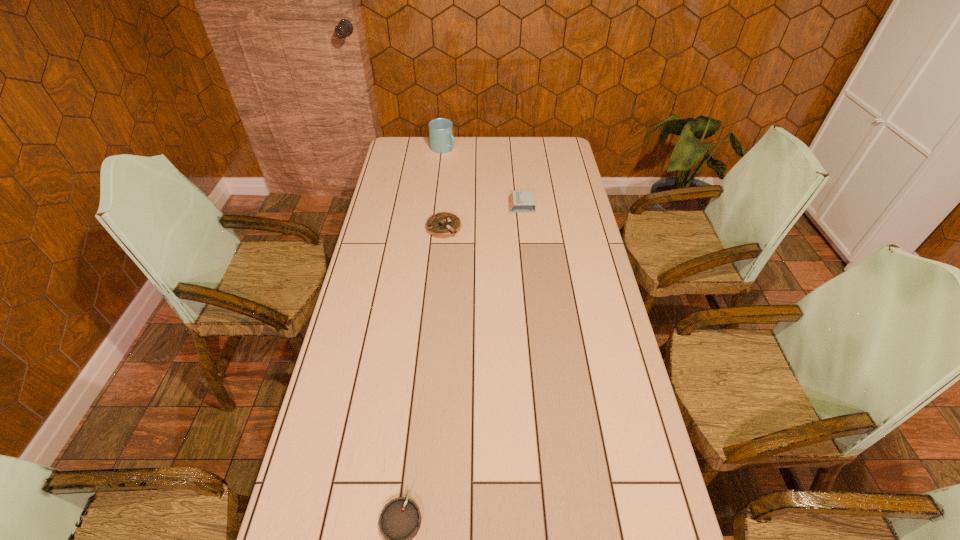
Identify which ashtray is the nearest to the tallest object. Please provide its 2D coordinates. Your answer should be formatted as a tuple, i.e. [(x, y)], where the tuple contains the x and y coordinates of a point satisfying the conditions above.

[(442, 225)]

Image resolution: width=960 pixels, height=540 pixels. Find the location of `free region that satisfies the following two spatial constraints: 1. on the front side of the rightmost object; 2. on the right side of the tallest object`. free region that satisfies the following two spatial constraints: 1. on the front side of the rightmost object; 2. on the right side of the tallest object is located at coordinates (437, 205).

I want to click on free space that satisfies the following two spatial constraints: 1. on the front side of the mug; 2. on the left side of the farther ashtray, so click(x=434, y=227).